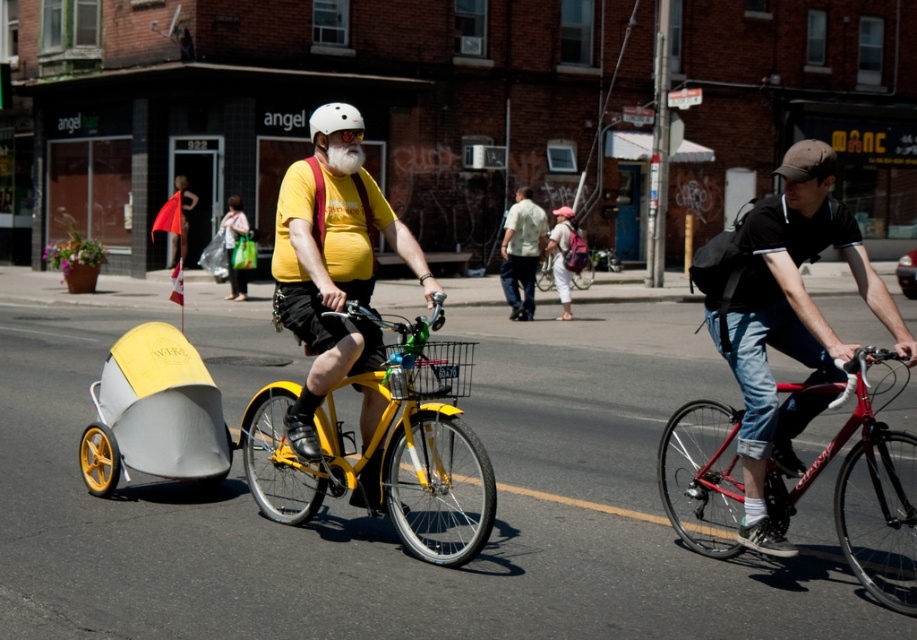
Question: Is denim jeans at center to the left of white matte bicycle helmet at upper center from the viewer's perspective?

Choices:
 (A) no
 (B) yes

Answer: (A)

Question: Can you confirm if matte yellow bicycle at center is positioned to the left of matte yellow helmet at center?

Choices:
 (A) no
 (B) yes

Answer: (A)

Question: Does matte yellow bicycle at center lie behind matte black bicycle at center?

Choices:
 (A) no
 (B) yes

Answer: (A)

Question: Which object is farther from the camera taking this photo?

Choices:
 (A) matte yellow bicycle at center
 (B) matte black bicycle at center
 (C) light beige shirt at center

Answer: (B)

Question: Which of the following is the closest to the observer?

Choices:
 (A) (771, 346)
 (B) (561, 256)
 (C) (859, 380)

Answer: (C)

Question: Estimate the real-world distances between objects in this image. Which object is farther from the yellow matte bicycle at center?

Choices:
 (A) denim jeans at center
 (B) matte black bicycle at center
 (C) matte pink backpack at center
 (D) light beige shirt at center

Answer: (B)